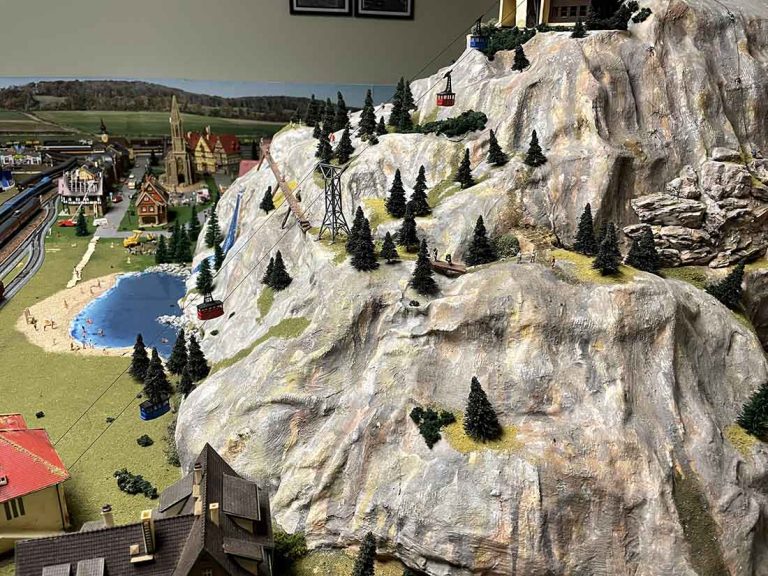
Locate an element on the screen. Image resolution: width=768 pixels, height=576 pixels. wall is located at coordinates (315, 58).